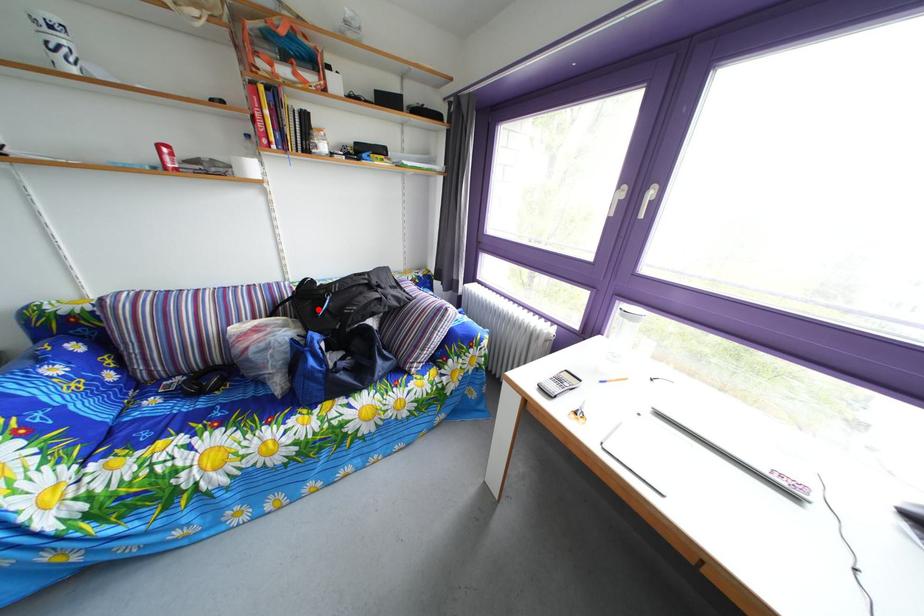
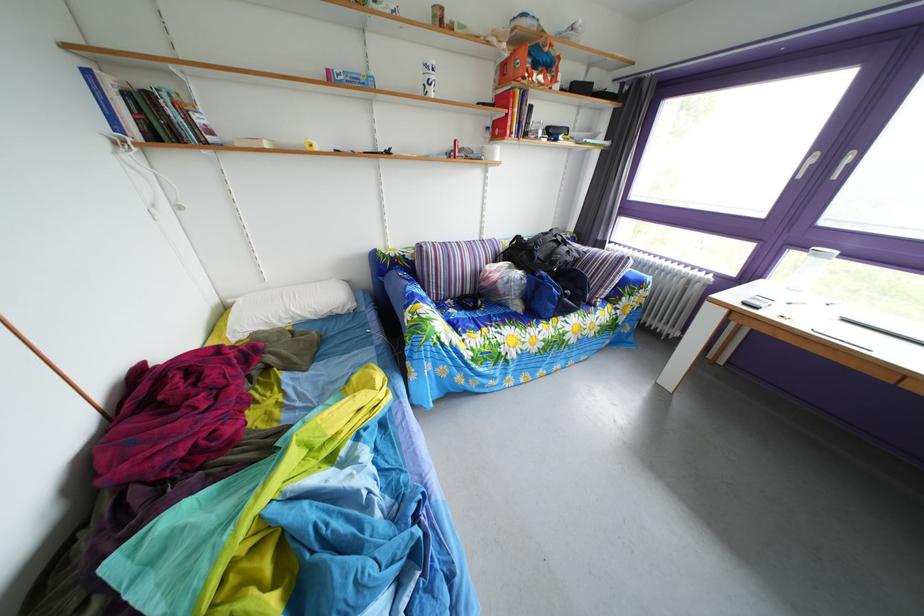
Question: I am providing you with two images of the same scene from different viewpoints. In image1, a red point is highlighted. Considering the same 3D point in image2, which of the following is correct?

Choices:
 (A) It is closer
 (B) It is farther

Answer: (A)